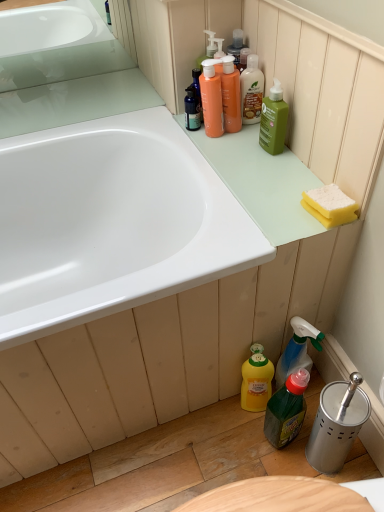
Question: Is point (213, 132) closer or farther from the camera than point (256, 117)?

Choices:
 (A) farther
 (B) closer

Answer: (A)

Question: From the image's perspective, relative to translucent plastic bottle at upper center, positioned as the 5th cleaning product in bottom-to-top order, is matte orange pump bottles at upper center, the fourth cleaning product positioned from the bottom, above or below?

Choices:
 (A) above
 (B) below

Answer: (B)

Question: Considering the real-world distances, which object is farthest from the translucent plastic mouthwash at upper center?

Choices:
 (A) translucent plastic bottle at upper center, positioned as the 5th cleaning product in bottom-to-top order
 (B) yellow matte bottle at lower center, positioned as the 1th cleaning product in bottom-to-top order
 (C) yellow sponge at upper right
 (D) translucent plastic spray bottle at lower right, which is counted as the 2th cleaning product, starting from the bottom
 (E) green matte bottle at upper right, which ranks as the third cleaning product in bottom-to-top order

Answer: (B)

Question: Estimate the real-world distances between objects in this image. Which object is closer to the translucent plastic mouthwash at upper center?

Choices:
 (A) yellow sponge at upper right
 (B) green matte bottle at upper right, which appears as the 3th cleaning product when viewed from the top
 (C) translucent green bottle at lower center
 (D) yellow matte bottle at lower center, positioned as the 1th cleaning product in bottom-to-top order
 (E) translucent plastic bottle at upper center, which appears as the first cleaning product when viewed from the top

Answer: (E)